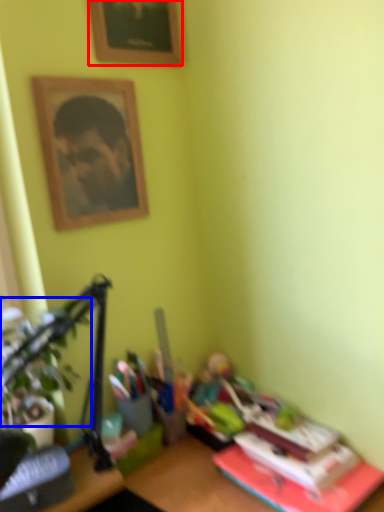
Question: Which object appears closest to the camera in this image, picture frame (highlighted by a red box) or plant (highlighted by a blue box)?

Choices:
 (A) picture frame
 (B) plant

Answer: (B)